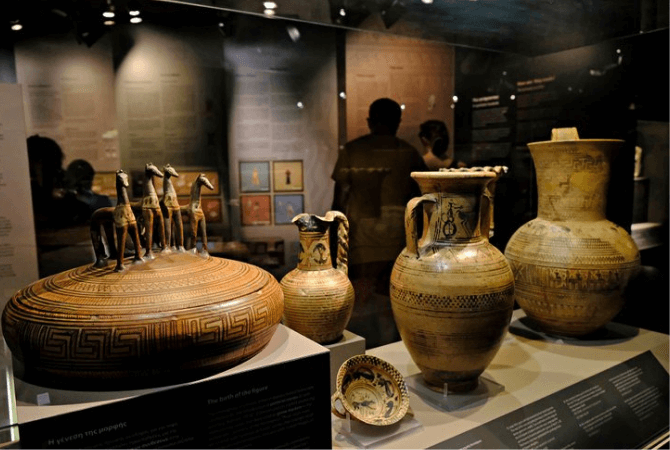
In order to click on lights in this screenshot , I will do `click(15, 30)`, `click(112, 15)`, `click(137, 18)`, `click(269, 11)`.